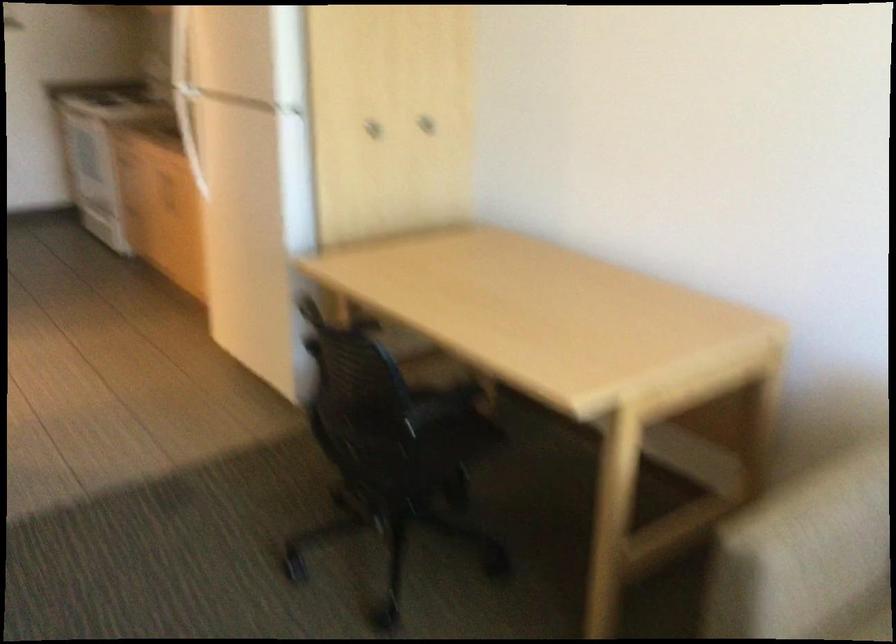
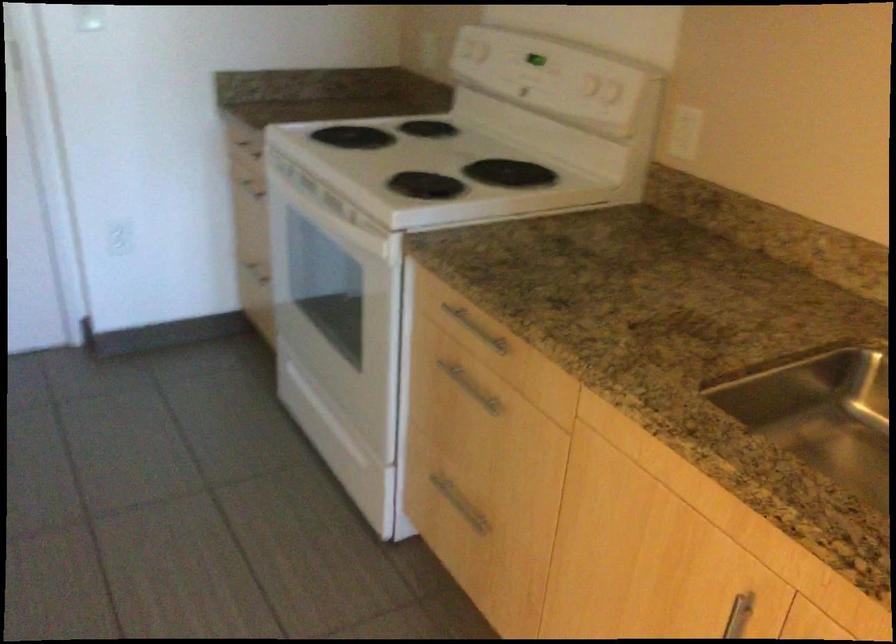
What movement of the cameraman would produce the second image?

The movement direction of the cameraman is left, forward.